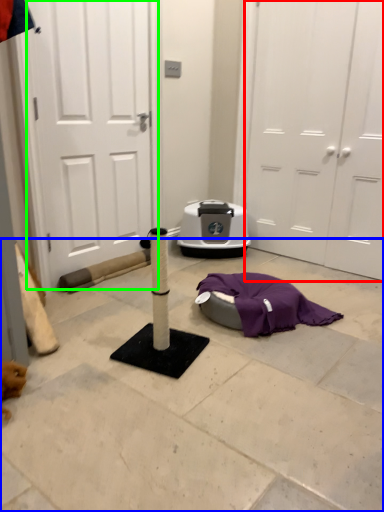
Question: Estimate the real-world distances between objects in this image. Which object is closer to door (highlighted by a red box), concrete (highlighted by a blue box) or door (highlighted by a green box)?

Choices:
 (A) concrete
 (B) door

Answer: (B)